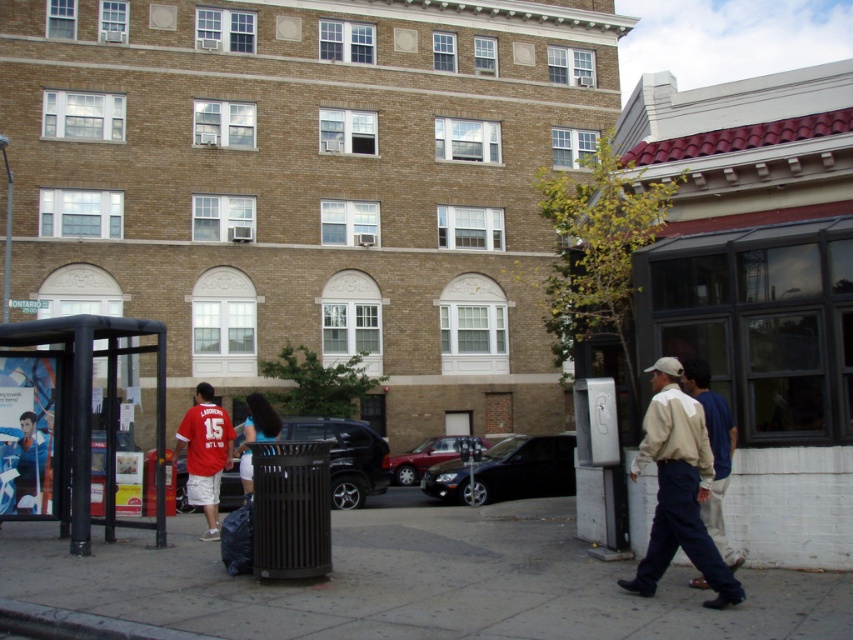
You are standing on the sidewalk and want to take a photo of the light beige sweater at center and the black glossy car at center. Which object should you focus on first to ensure both are in focus?

You should focus on the light beige sweater at center first because it is closer to you than the black glossy car at center, so adjusting focus from near to far will help both be in focus.

You are a pedestrian standing on the sidewalk and want to cross the street to reach the blue fabric shirt at center. There is a black glossy car at center in the way. Can you safely walk around the car to reach your destination?

The black glossy car at center and blue fabric shirt at center are 23.06 feet apart. Since the car is between you and the shirt, you can safely walk around the car to reach the blue fabric shirt at center as there is sufficient space between them.